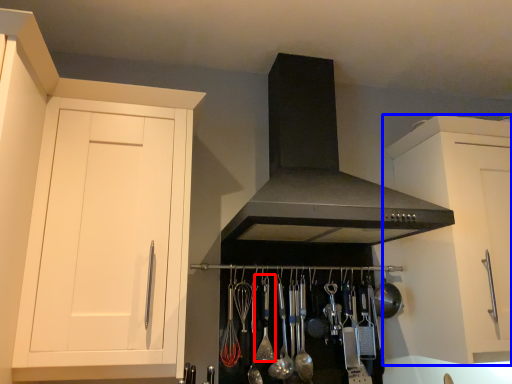
Question: Which object is closer to the camera taking this photo, utensil (highlighted by a red box) or cabinetry (highlighted by a blue box)?

Choices:
 (A) utensil
 (B) cabinetry

Answer: (B)